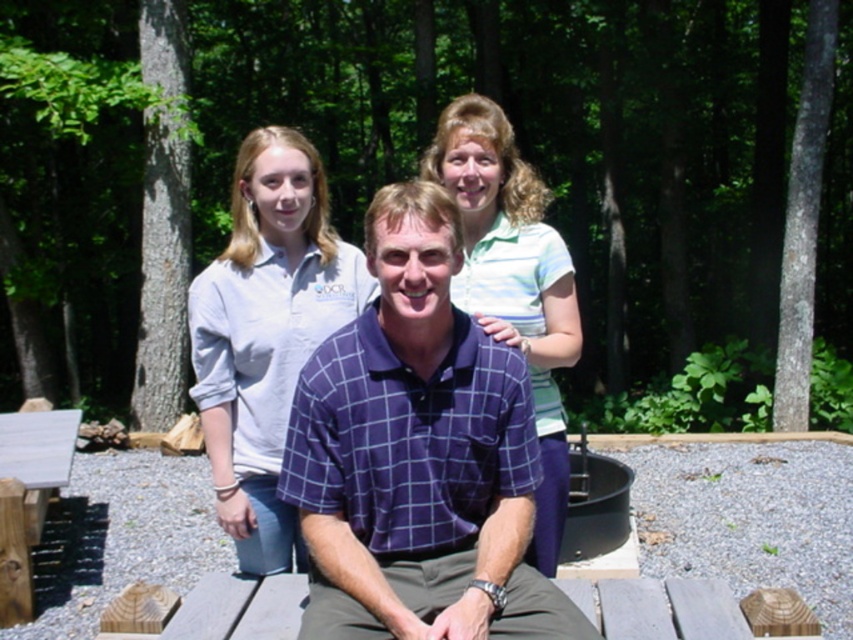
Can you confirm if light blue cotton shirt at upper left is shorter than wooden picnic table at lower left?

Incorrect, light blue cotton shirt at upper left's height does not fall short of wooden picnic table at lower left's.

Is light blue cotton shirt at upper left wider than wooden picnic table at lower left?

No.

Where is `light blue cotton shirt at upper left`? This screenshot has height=640, width=853. light blue cotton shirt at upper left is located at coordinates (265, 333).

Where is `light blue cotton shirt at upper left`? The image size is (853, 640). light blue cotton shirt at upper left is located at coordinates (265, 333).

This screenshot has width=853, height=640. Find the location of `purple checkered shirt at center`. purple checkered shirt at center is located at coordinates (418, 456).

Does point (366, 628) come farther from viewer compared to point (15, 529)?

No.

I want to click on purple checkered shirt at center, so click(418, 456).

Which is behind, point (494, 564) or point (566, 307)?

The point (566, 307) is behind.

Is point (340, 625) more distant than point (549, 396)?

No, it is not.

Where is `purple checkered shirt at center`? The height and width of the screenshot is (640, 853). purple checkered shirt at center is located at coordinates (418, 456).